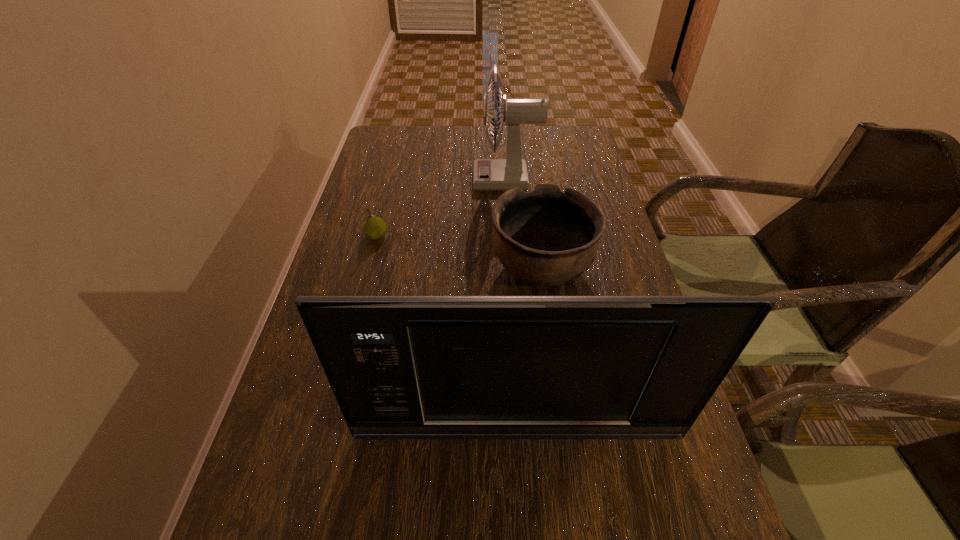
I want to click on vacant area situated 0.290m on the back of the leftmost object, so click(x=394, y=171).

Identify the location of object that is at the far edge. This screenshot has height=540, width=960. 489,174.

Identify the location of microwave oven located at the left edge. This screenshot has height=540, width=960. (401, 367).

You are a GUI agent. You are given a task and a screenshot of the screen. Output one action in this format:
    pyautogui.click(x=<x>, y=<y>)
    Task: Click on the pear situated at the left edge
    The width and height of the screenshot is (960, 540).
    Given the screenshot: What is the action you would take?
    pyautogui.click(x=374, y=228)

The height and width of the screenshot is (540, 960). Identify the location of microwave oven that is at the right edge. (401, 367).

You are a GUI agent. You are given a task and a screenshot of the screen. Output one action in this format:
    pyautogui.click(x=<x>, y=<y>)
    Task: Click on the pottery at the right edge
    The image size is (960, 540).
    Given the screenshot: What is the action you would take?
    point(547,237)

Identify the location of vacant region at the far edge. (491, 148).

What are the coordinates of `vacant area at the left edge` in the screenshot? It's located at (311, 344).

Identify the location of free region at the right edge. The height and width of the screenshot is (540, 960). (631, 477).

Where is `vacant space at the far left corner of the desktop`? This screenshot has height=540, width=960. vacant space at the far left corner of the desktop is located at coordinates (374, 136).